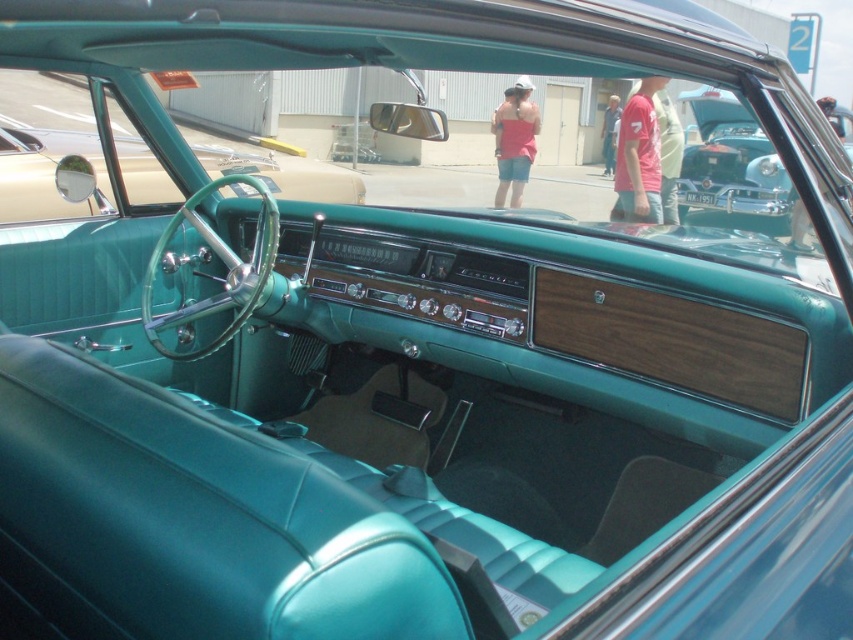
Question: Which point appears farthest from the camera in this image?

Choices:
 (A) (32, 164)
 (B) (724, 96)

Answer: (B)

Question: Is teal leather steering wheel at center to the right of teal leather car at upper right from the viewer's perspective?

Choices:
 (A) no
 (B) yes

Answer: (A)

Question: Which object is farther from the camera taking this photo?

Choices:
 (A) teal leather steering wheel at center
 (B) teal leather car at upper right

Answer: (B)

Question: Which point is farther from the camera taking this photo?

Choices:
 (A) click(x=761, y=156)
 (B) click(x=250, y=157)

Answer: (A)

Question: Is the position of teal leather steering wheel at center less distant than that of teal leather car at upper right?

Choices:
 (A) yes
 (B) no

Answer: (A)

Question: Does teal leather steering wheel at center have a lesser width compared to teal leather car at upper right?

Choices:
 (A) yes
 (B) no

Answer: (B)